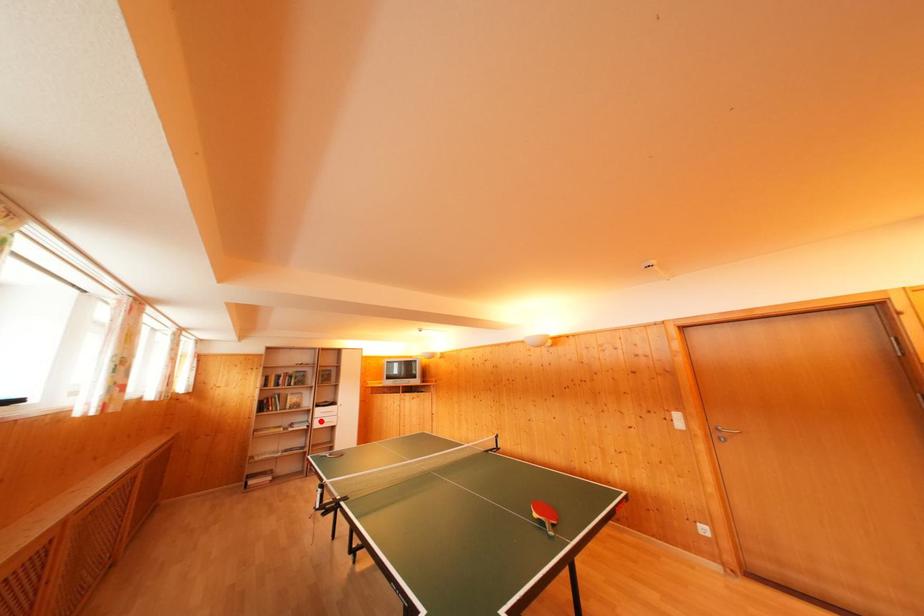
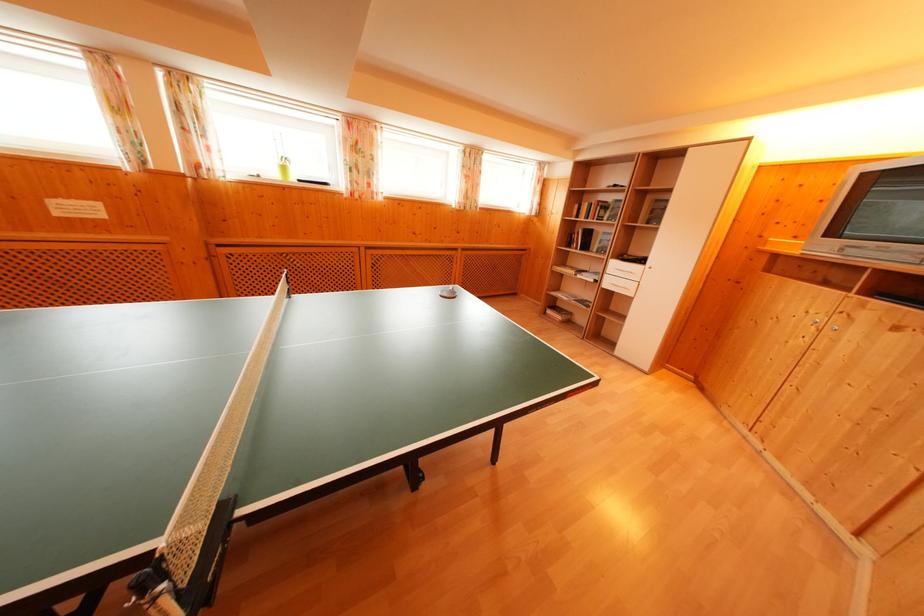
Question: I am providing you with two images of the same scene from different viewpoints. A red point is marked on the first image. Can you still see the location of the red point in image 2?

Choices:
 (A) Yes
 (B) No

Answer: (A)